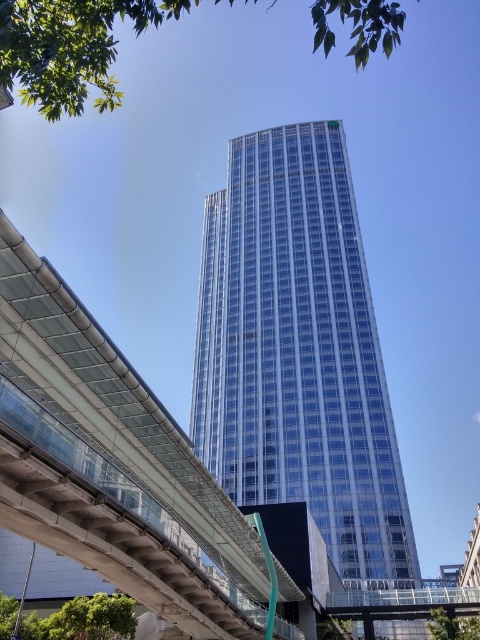
Question: Is transparent glass overpass at lower left to the right of green leafy tree at lower right from the viewer's perspective?

Choices:
 (A) no
 (B) yes

Answer: (A)

Question: Does green leafy tree at lower left come behind green leafy tree at lower right?

Choices:
 (A) no
 (B) yes

Answer: (A)

Question: Estimate the real-world distances between objects in this image. Which object is closer to the transparent glass overpass at lower left?

Choices:
 (A) green leafy tree at lower left
 (B) transparent glass tower at center
 (C) green leafy tree at lower right
 (D) green leafy tree at lower center

Answer: (A)

Question: Among these points, which one is nearest to the camera?

Choices:
 (A) (348, 634)
 (B) (149, 609)
 (C) (108, 621)

Answer: (B)

Question: Which object is positioned farthest from the green leafy tree at lower center?

Choices:
 (A) green leafy tree at upper left
 (B) transparent glass overpass at lower left
 (C) green leafy tree at lower right
 (D) green leafy tree at lower left

Answer: (A)

Question: Is green leafy tree at upper left below green leafy tree at lower right?

Choices:
 (A) no
 (B) yes

Answer: (A)